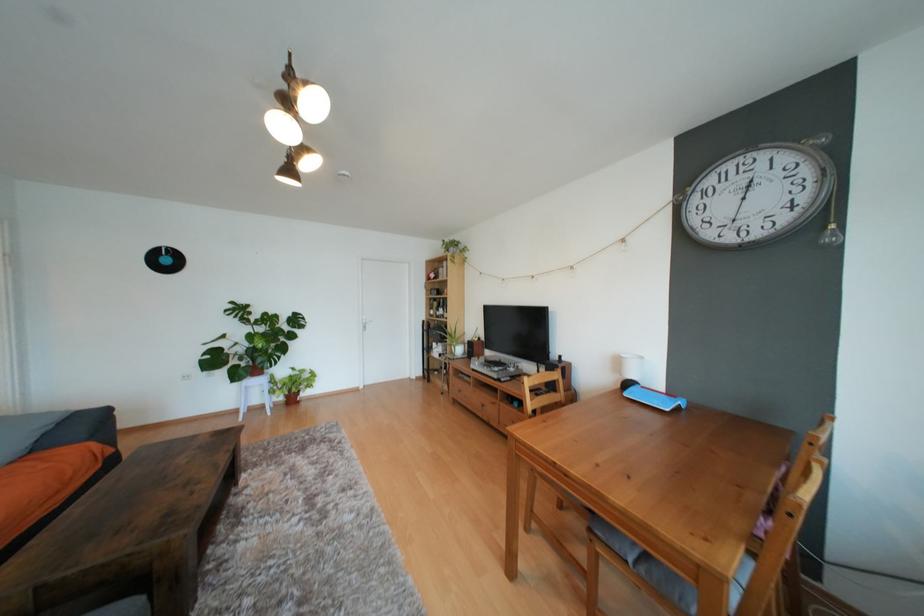
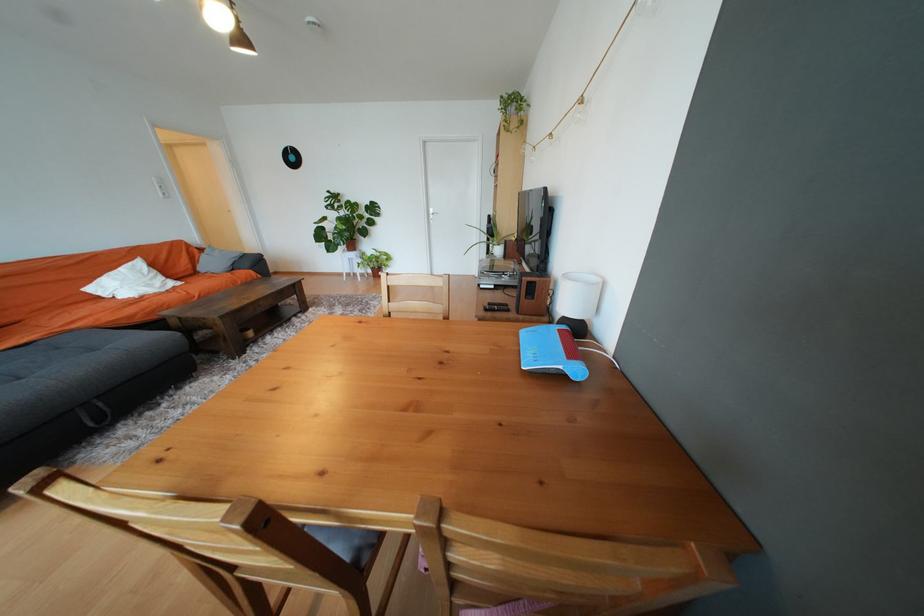
Where in the second image is the point corresponding to (523,378) from the first image?

(517, 288)